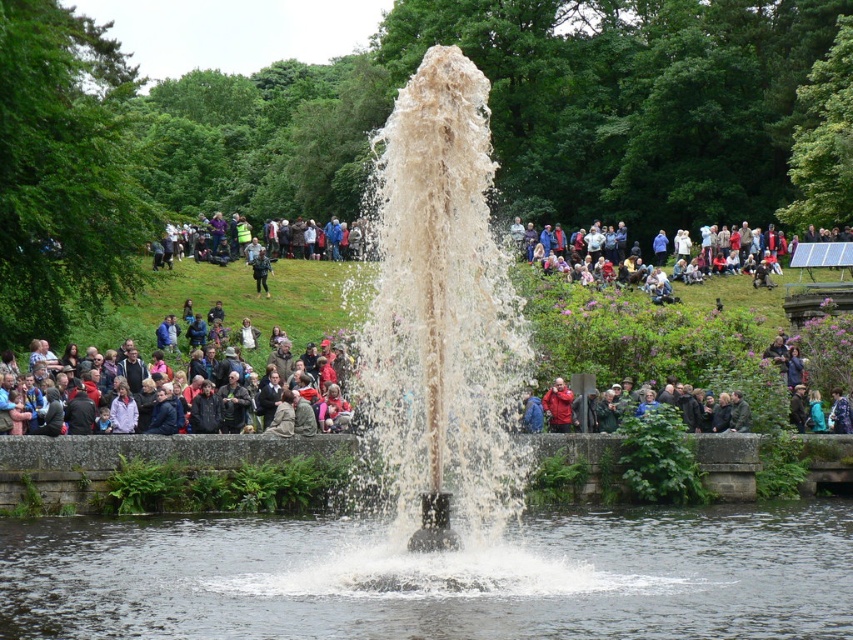
Question: Estimate the real-world distances between objects in this image. Which object is closer to the red fabric jacket at center?

Choices:
 (A) matte black jacket at center
 (B) white frothy water at center
 (C) dark gray jacket at center
 (D) clear water at center

Answer: (B)

Question: Does clear water at center appear under matte black jacket at center?

Choices:
 (A) yes
 (B) no

Answer: (A)

Question: Which is nearer to the white frothy water at center?

Choices:
 (A) clear water at center
 (B) matte black jacket at center

Answer: (A)

Question: Does white frothy water at center have a lesser width compared to matte black jacket at center?

Choices:
 (A) no
 (B) yes

Answer: (B)

Question: Which point is farther to the camera?

Choices:
 (A) (467, 179)
 (B) (267, 288)
 (C) (689, 612)
 (D) (239, 317)

Answer: (B)

Question: Is matte black jacket at center positioned at the back of dark gray jacket at center?

Choices:
 (A) yes
 (B) no

Answer: (B)